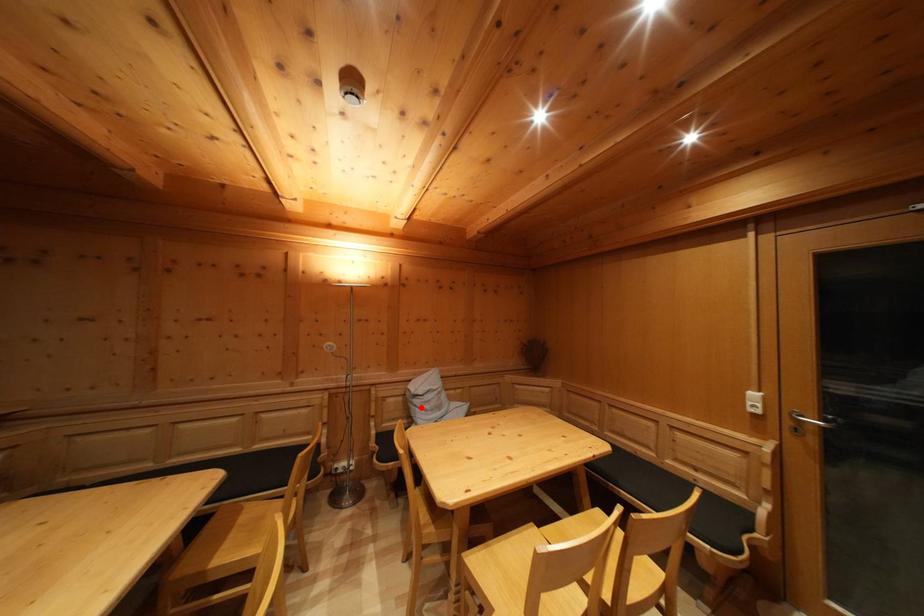
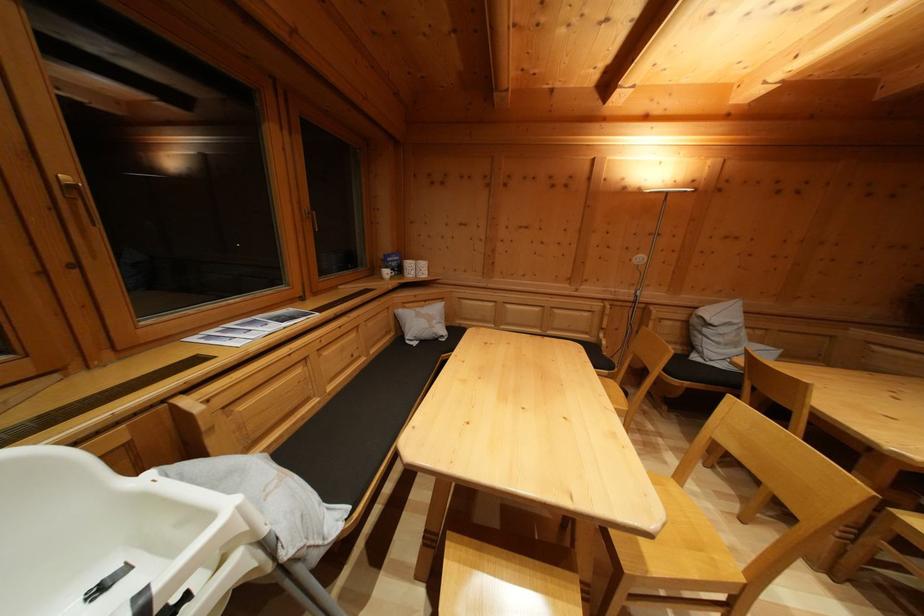
Where in the second image is the point corresponding to the highlighted location from the first image?

(711, 337)